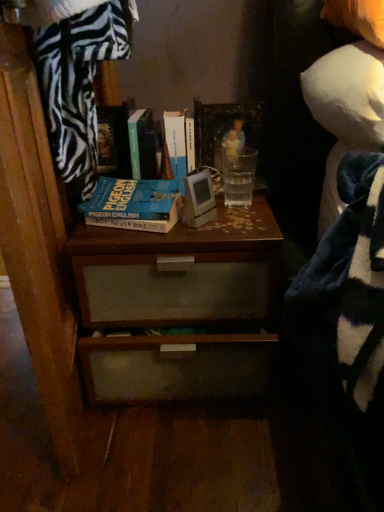
At what (x,y) coordinates should I click in order to perform the action: click on vacant space to the right of blue matte book at center, positioned as the 1th book in left-to-right order. Please return your answer as a coordinate pair (x, y). Looking at the image, I should click on (231, 223).